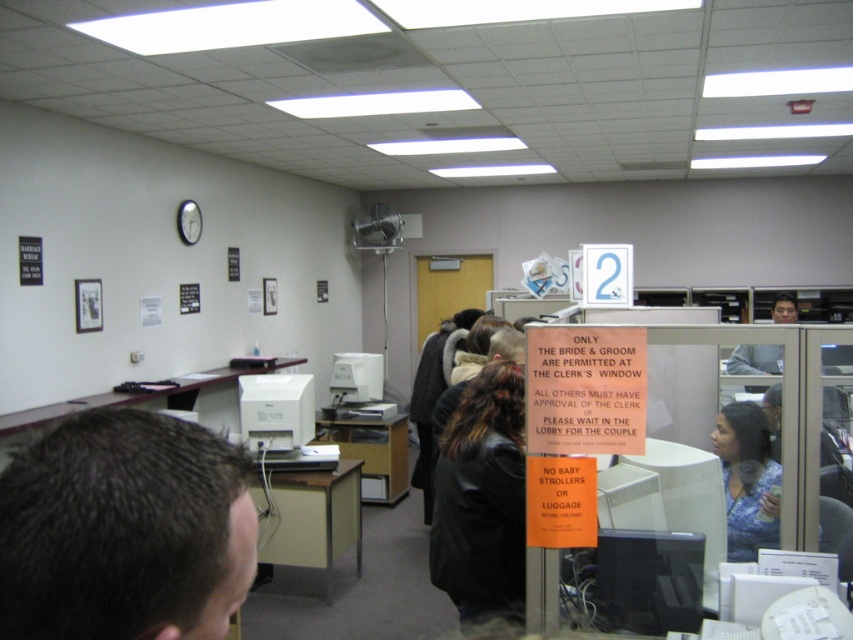
You are a visitor in the office and need to determine the spatial relationship between the black leather jacket at center and the blue printed blouse at right. Which object is located lower in the image?

The black leather jacket at center is positioned under blue printed blouse at right, so it is located lower in the image.

You are a visitor in this office and need to determine which clothing item is closer to the entrance. You see a black leather jacket at center and a blue printed blouse at right. Based on their positions, which one is more to the left?

The black leather jacket at center is positioned on the left side of the blue printed blouse at right, so it is closer to the entrance.